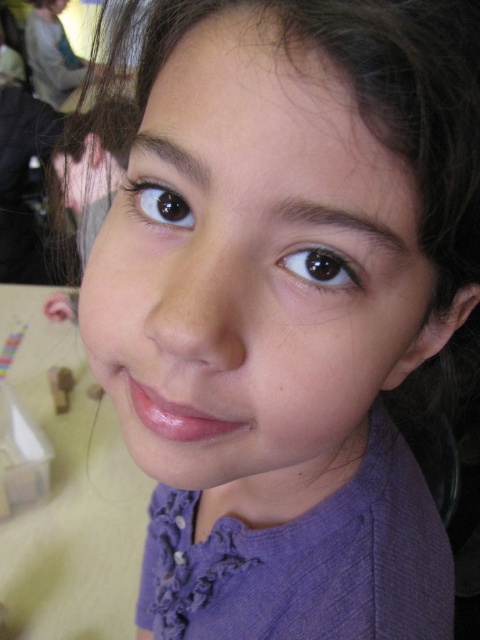
Is smooth skin face at center closer to camera compared to brown glossy eye at upper center?

That is True.

Between smooth skin face at center and brown glossy eye at upper center, which one is positioned lower?

smooth skin face at center

Does point (232, 387) come farther from viewer compared to point (321, 269)?

Yes, it is.

Where is `smooth skin face at center`? The width and height of the screenshot is (480, 640). smooth skin face at center is located at coordinates (255, 269).

Can you confirm if brown glossy eye at upper center is shorter than brown glossy eye at upper left?

Indeed, brown glossy eye at upper center has a lesser height compared to brown glossy eye at upper left.

The image size is (480, 640). What are the coordinates of `brown glossy eye at upper center` in the screenshot? It's located at (320, 266).

This screenshot has height=640, width=480. Identify the location of brown glossy eye at upper center. (320, 266).

Which of these two, smooth skin face at center or brown glossy eye at upper left, stands shorter?

brown glossy eye at upper left

Is smooth skin face at center closer to camera compared to brown glossy eye at upper left?

Yes, smooth skin face at center is closer to the viewer.

Which is behind, point (164, 298) or point (179, 204)?

Point (179, 204)

The image size is (480, 640). I want to click on smooth skin face at center, so click(x=255, y=269).